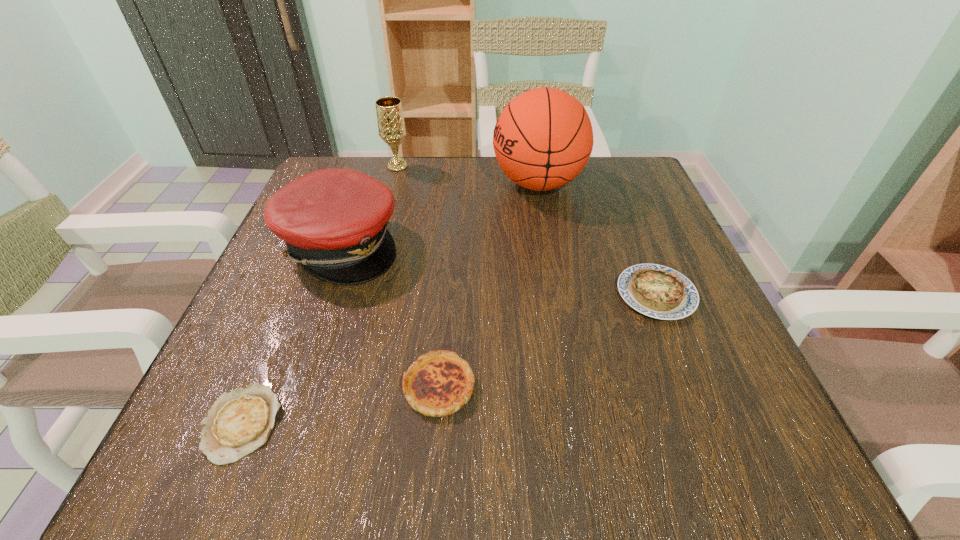
Identify the location of blank area located 0.340m on the right of the chalice. (548, 166).

Identify the location of vacant space located 0.100m on the front-facing side of the cap. (450, 245).

The width and height of the screenshot is (960, 540). Find the location of `free space located on the back of the rightmost quiche`. free space located on the back of the rightmost quiche is located at coordinates (603, 160).

This screenshot has height=540, width=960. I want to click on vacant space situated on the back of the second quiche from right to left, so (x=447, y=275).

Locate an element on the screen. vacant region located 0.240m on the right of the shortest quiche is located at coordinates (454, 424).

At what (x,y) coordinates should I click in order to perform the action: click on basketball located in the far edge section of the desktop. Please return your answer as a coordinate pair (x, y). Looking at the image, I should click on (542, 140).

The height and width of the screenshot is (540, 960). Find the location of `chalice situated at the far edge`. chalice situated at the far edge is located at coordinates (391, 126).

I want to click on cap that is at the far edge, so click(x=334, y=221).

Identify the location of chalice situated at the left edge. The width and height of the screenshot is (960, 540). (391, 126).

This screenshot has width=960, height=540. What are the coordinates of `cap located in the left edge section of the desktop` in the screenshot? It's located at (334, 221).